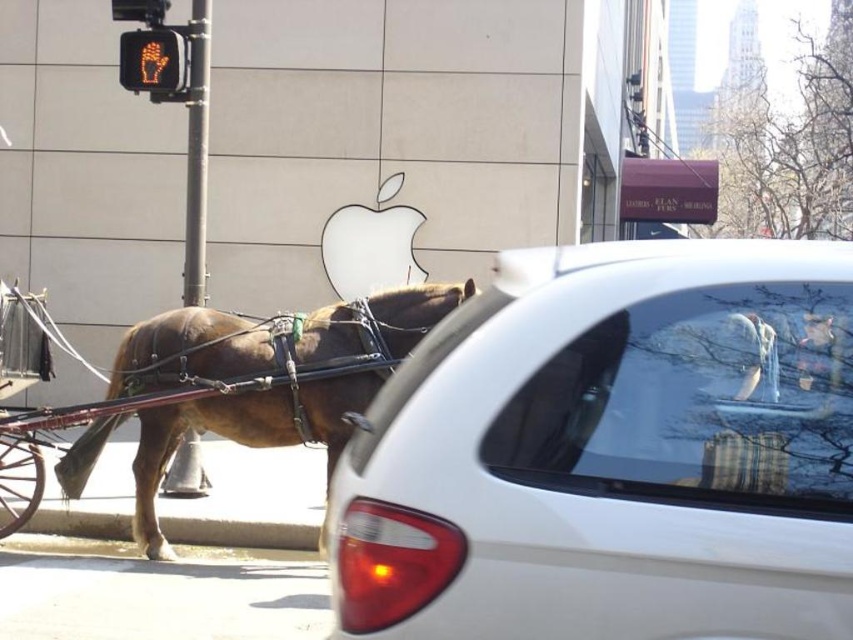
Question: Among these points, which one is nearest to the camera?

Choices:
 (A) (704, 372)
 (B) (283, 429)

Answer: (A)

Question: Does white glossy car at center appear under brown leather horse at left?

Choices:
 (A) yes
 (B) no

Answer: (B)

Question: Observing the image, what is the correct spatial positioning of white glossy car at center in reference to brown leather horse at left?

Choices:
 (A) below
 (B) above

Answer: (B)

Question: Can you confirm if white glossy car at center is positioned above brown leather horse at left?

Choices:
 (A) no
 (B) yes

Answer: (B)

Question: Which of the following is the closest to the observer?

Choices:
 (A) (289, 438)
 (B) (454, 358)

Answer: (B)